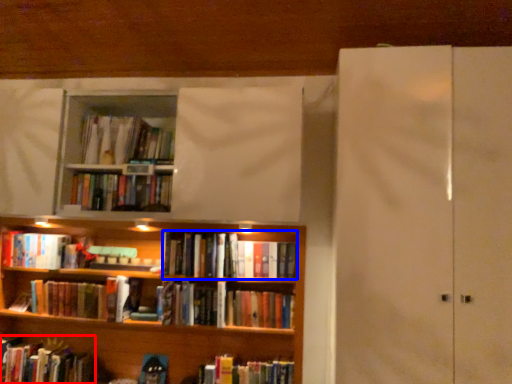
Question: Which object appears farthest to the camera in this image, book (highlighted by a red box) or book (highlighted by a blue box)?

Choices:
 (A) book
 (B) book

Answer: (A)